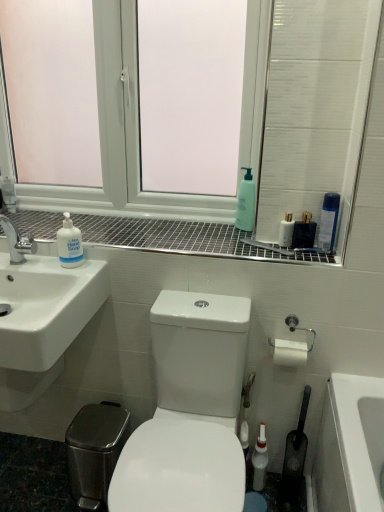
This screenshot has height=512, width=384. In order to click on free point below white glossy sink at lower left (from a real-world perspective) in this screenshot , I will do `click(28, 474)`.